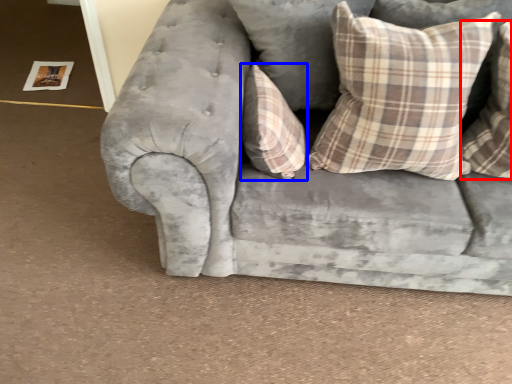
Question: Which of the following is the closest to the observer, pillow (highlighted by a red box) or pillow (highlighted by a blue box)?

Choices:
 (A) pillow
 (B) pillow

Answer: (A)